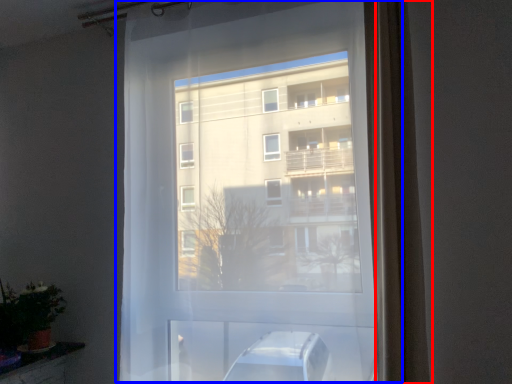
Question: Among these objects, which one is nearest to the camera, curtain (highlighted by a red box) or window (highlighted by a blue box)?

Choices:
 (A) curtain
 (B) window

Answer: (A)